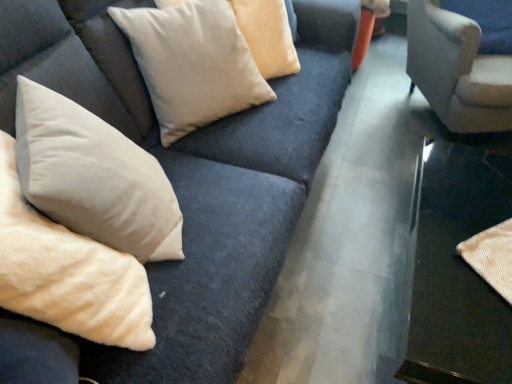
Question: Is suede-like beige pillow at upper center, which ranks as the second pillow in front-to-back order, to the right of velvet beige pillows at upper left from the viewer's perspective?

Choices:
 (A) no
 (B) yes

Answer: (B)

Question: From a real-world perspective, is suede-like beige pillow at upper center, which ranks as the second pillow in front-to-back order, located higher than velvet beige pillows at upper left?

Choices:
 (A) yes
 (B) no

Answer: (A)

Question: Is suede-like beige pillow at upper center, which ranks as the second pillow in front-to-back order, bigger than velvet beige pillows at upper left?

Choices:
 (A) no
 (B) yes

Answer: (A)

Question: Can you confirm if suede-like beige pillow at upper center, which ranks as the second pillow in front-to-back order, is smaller than velvet beige pillows at upper left?

Choices:
 (A) yes
 (B) no

Answer: (A)

Question: Is suede-like beige pillow at upper center, which ranks as the second pillow in front-to-back order, outside velvet beige pillows at upper left?

Choices:
 (A) no
 (B) yes

Answer: (B)

Question: Would you say white soft pillow at lower left, the second pillow viewed from the back, is to the left or to the right of suede-like beige pillow at upper center, which ranks as the second pillow in front-to-back order, in the picture?

Choices:
 (A) left
 (B) right

Answer: (A)

Question: Is white soft pillow at lower left, the 1th pillow from the front, spatially inside suede-like beige pillow at upper center, the first pillow viewed from the back, or outside of it?

Choices:
 (A) outside
 (B) inside

Answer: (A)

Question: From their relative heights in the image, would you say white soft pillow at lower left, the 1th pillow from the front, is taller or shorter than suede-like beige pillow at upper center, which ranks as the second pillow in front-to-back order?

Choices:
 (A) short
 (B) tall

Answer: (B)

Question: Considering the positions of white soft pillow at lower left, the second pillow viewed from the back, and suede-like beige pillow at upper center, which ranks as the second pillow in front-to-back order, in the image, is white soft pillow at lower left, the second pillow viewed from the back, wider or thinner than suede-like beige pillow at upper center, which ranks as the second pillow in front-to-back order,?

Choices:
 (A) wide
 (B) thin

Answer: (B)

Question: Considering the positions of metallic silver table at lower right and suede-like beige pillow at upper center, the first pillow viewed from the back, in the image, is metallic silver table at lower right bigger or smaller than suede-like beige pillow at upper center, the first pillow viewed from the back,?

Choices:
 (A) big
 (B) small

Answer: (A)

Question: From a real-world perspective, is metallic silver table at lower right above or below suede-like beige pillow at upper center, the first pillow viewed from the back?

Choices:
 (A) below
 (B) above

Answer: (A)

Question: Is metallic silver table at lower right taller or shorter than suede-like beige pillow at upper center, the first pillow viewed from the back?

Choices:
 (A) short
 (B) tall

Answer: (A)

Question: Do you think metallic silver table at lower right is within suede-like beige pillow at upper center, which ranks as the second pillow in front-to-back order, or outside of it?

Choices:
 (A) outside
 (B) inside

Answer: (A)

Question: In the image, is velvet beige pillows at upper left on the left side or the right side of white soft pillow at lower left, the 1th pillow from the front?

Choices:
 (A) right
 (B) left

Answer: (A)

Question: Considering the positions of velvet beige pillows at upper left and white soft pillow at lower left, the second pillow viewed from the back, in the image, is velvet beige pillows at upper left bigger or smaller than white soft pillow at lower left, the second pillow viewed from the back,?

Choices:
 (A) small
 (B) big

Answer: (A)